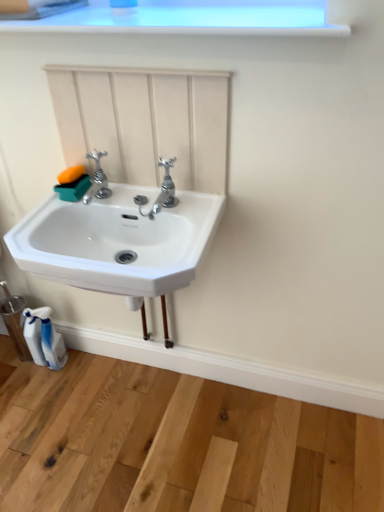
Image resolution: width=384 pixels, height=512 pixels. Identify the location of vacant space to the right of polished chrome faucet at center, which appears as the 2th tap when viewed from the left. (193, 210).